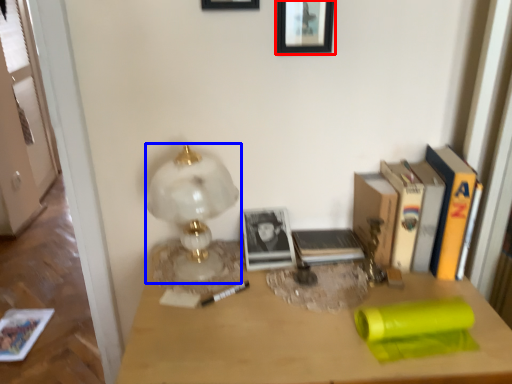
Question: Which of the following is the farthest to the observer, picture frame (highlighted by a red box) or lamp (highlighted by a blue box)?

Choices:
 (A) picture frame
 (B) lamp

Answer: (A)